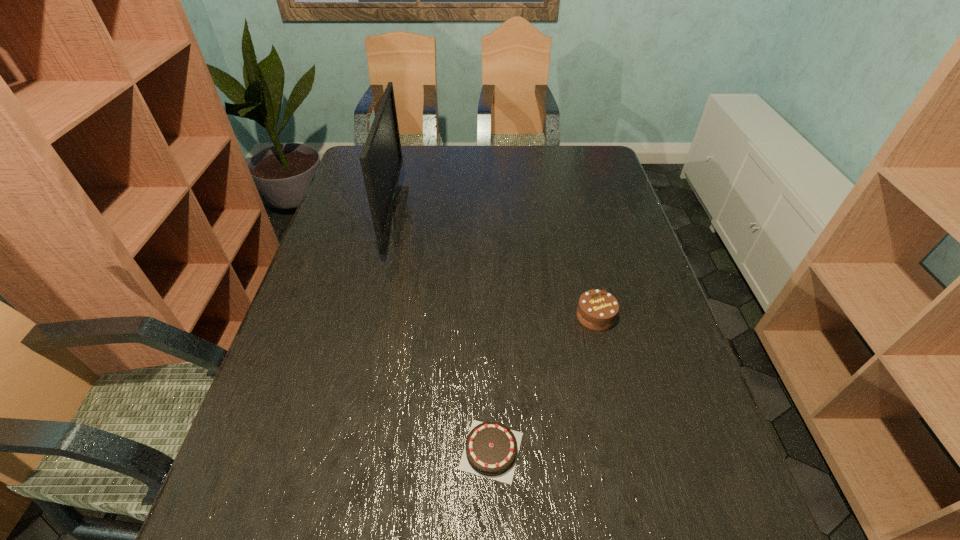
At what (x,y) coordinates should I click in order to perform the action: click on vacant space in between the taller chocolate cake and the tallest object. Please return your answer as a coordinate pair (x, y). This screenshot has width=960, height=540. Looking at the image, I should click on [495, 267].

The width and height of the screenshot is (960, 540). I want to click on vacant space in between the left chocolate cake and the second shortest object, so click(x=543, y=383).

Identify the location of vacant space that is in between the taller chocolate cake and the monitor. (495, 267).

What are the coordinates of `unoccupied area between the farther chocolate cake and the nearer chocolate cake` in the screenshot? It's located at (543, 383).

The width and height of the screenshot is (960, 540). I want to click on object that is the closest to the nearer chocolate cake, so click(597, 310).

Select which object is the closest to the monitor. Please provide its 2D coordinates. Your answer should be formatted as a tuple, i.e. [(x, y)], where the tuple contains the x and y coordinates of a point satisfying the conditions above.

[(597, 310)]

Where is `free space that satisfies the following two spatial constraints: 1. on the front-facing side of the tallest object; 2. on the left side of the left chocolate cake`? Image resolution: width=960 pixels, height=540 pixels. free space that satisfies the following two spatial constraints: 1. on the front-facing side of the tallest object; 2. on the left side of the left chocolate cake is located at coordinates (344, 450).

The height and width of the screenshot is (540, 960). I want to click on free spot that satisfies the following two spatial constraints: 1. on the front-facing side of the nearer chocolate cake; 2. on the left side of the farthest object, so pos(344,450).

This screenshot has width=960, height=540. Identify the location of blank area in the image that satisfies the following two spatial constraints: 1. on the back side of the taller chocolate cake; 2. on the front-facing side of the farthest object. (572, 217).

Locate an element on the screen. vacant space that satisfies the following two spatial constraints: 1. on the back side of the second object from right to left; 2. on the front-facing side of the monitor is located at coordinates (487, 217).